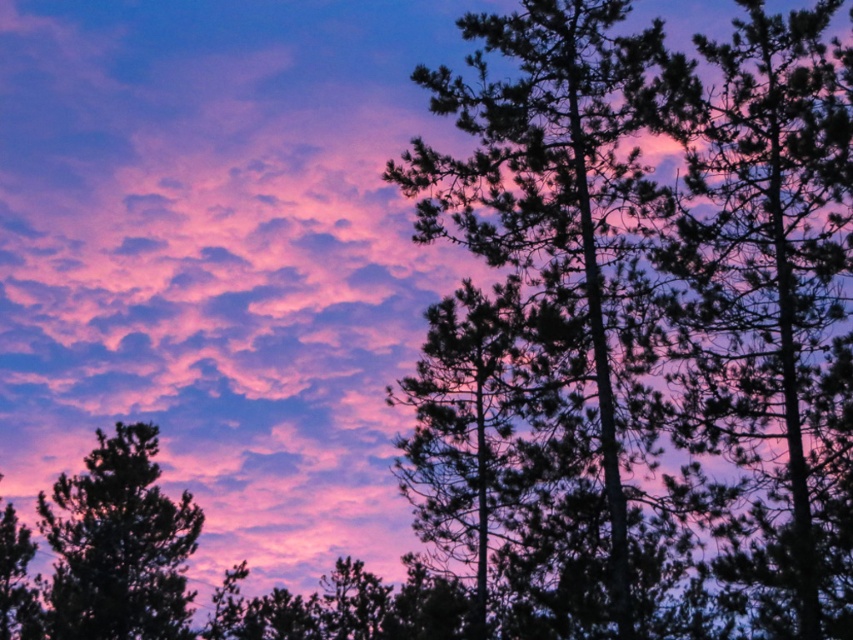
Consider the image. You are an astronomer analyzing the sunset scene. You notice a point at coordinates point (556, 227). What object is located at this point?

The silhouette tree at center is located at point (556, 227).

You are an artist sketching the sunset scene. You notice the black textured tree at center and the silhouette tree at center. Which tree is positioned lower in the image?

The black textured tree at center is located below the silhouette tree at center, so it is positioned lower in the image.